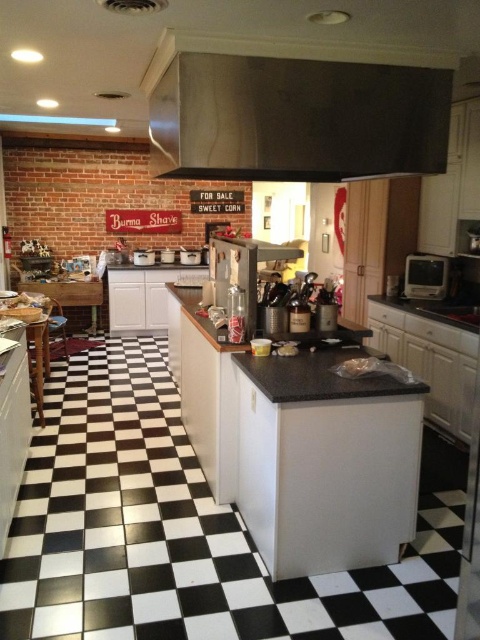
Question: Is black granite sink at right behind white glossy toaster at center?

Choices:
 (A) no
 (B) yes

Answer: (A)

Question: Among these objects, which one is nearest to the camera?

Choices:
 (A) stainless steel exhaust hood at upper center
 (B) metallic silver toaster at right
 (C) white glossy toaster at center

Answer: (A)

Question: From the image, what is the correct spatial relationship of stainless steel exhaust hood at upper center in relation to black granite countertop at center?

Choices:
 (A) above
 (B) below

Answer: (A)

Question: Which point is closer to the camera?

Choices:
 (A) black granite countertop at center
 (B) white glossy toaster at center

Answer: (A)

Question: Is stainless steel exhaust hood at upper center to the right of black granite sink at right from the viewer's perspective?

Choices:
 (A) yes
 (B) no

Answer: (B)

Question: Which point is farther to the camera?

Choices:
 (A) stainless steel exhaust hood at upper center
 (B) white glossy toaster at center
 (C) black granite countertop at center
 (D) metallic silver toaster at right

Answer: (B)